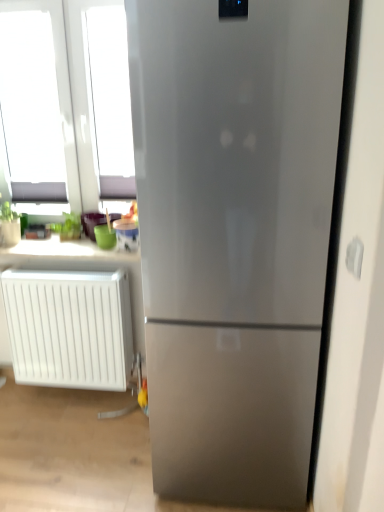
Question: Does white plastic radiator at lower left touch white plastic electric outlet at right?

Choices:
 (A) no
 (B) yes

Answer: (A)

Question: Can white plastic electric outlet at right be found inside white plastic radiator at lower left?

Choices:
 (A) no
 (B) yes

Answer: (A)

Question: Does white plastic radiator at lower left lie in front of white plastic electric outlet at right?

Choices:
 (A) no
 (B) yes

Answer: (A)

Question: Considering the relative sizes of white plastic radiator at lower left and white plastic electric outlet at right in the image provided, is white plastic radiator at lower left taller than white plastic electric outlet at right?

Choices:
 (A) no
 (B) yes

Answer: (B)

Question: Are white plastic radiator at lower left and white plastic electric outlet at right far apart?

Choices:
 (A) yes
 (B) no

Answer: (A)

Question: Can you confirm if white plastic radiator at lower left is bigger than white plastic electric outlet at right?

Choices:
 (A) no
 (B) yes

Answer: (B)

Question: Considering the relative sizes of matte white counter top at upper left and white plastic radiator at lower left in the image provided, is matte white counter top at upper left bigger than white plastic radiator at lower left?

Choices:
 (A) yes
 (B) no

Answer: (B)

Question: Is matte white counter top at upper left oriented towards white plastic radiator at lower left?

Choices:
 (A) yes
 (B) no

Answer: (B)

Question: Is matte white counter top at upper left thinner than white plastic radiator at lower left?

Choices:
 (A) yes
 (B) no

Answer: (B)

Question: Does matte white counter top at upper left appear on the right side of white plastic radiator at lower left?

Choices:
 (A) no
 (B) yes

Answer: (B)

Question: From the image's perspective, is matte white counter top at upper left over white plastic radiator at lower left?

Choices:
 (A) no
 (B) yes

Answer: (B)

Question: Is matte white counter top at upper left wider than white plastic radiator at lower left?

Choices:
 (A) yes
 (B) no

Answer: (A)

Question: Would you say matte white counter top at upper left is outside white plastic electric outlet at right?

Choices:
 (A) no
 (B) yes

Answer: (B)